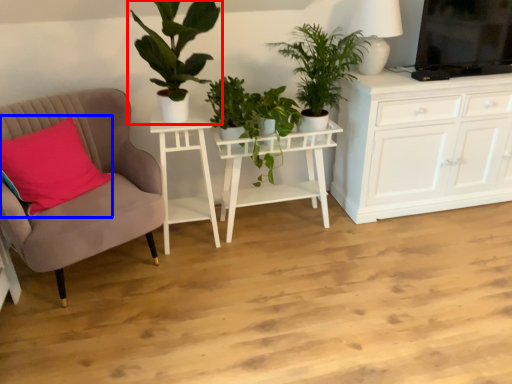
Question: Which object appears closest to the camera in this image, houseplant (highlighted by a red box) or pillow (highlighted by a blue box)?

Choices:
 (A) houseplant
 (B) pillow

Answer: (A)